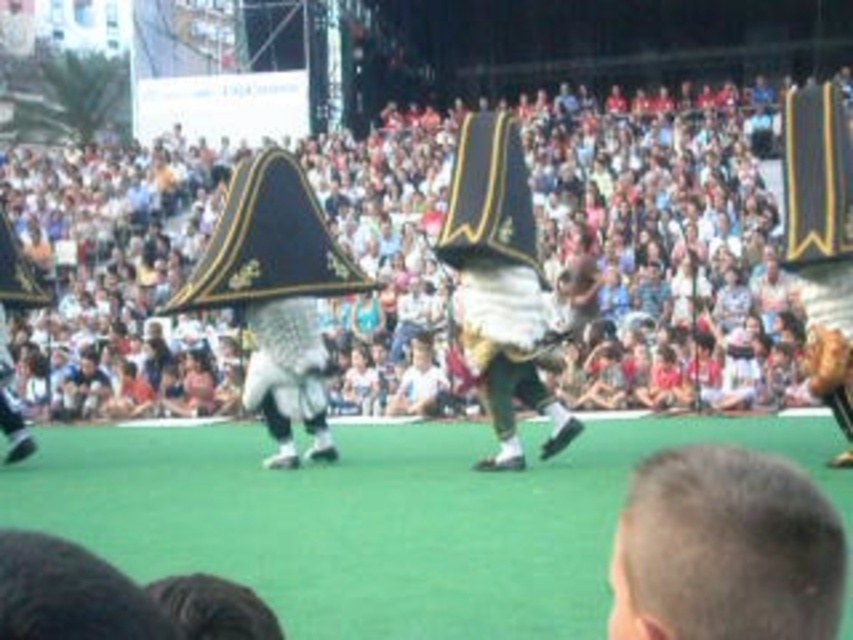
Question: Which point is farther to the camera?

Choices:
 (A) matte white crowd at upper center
 (B) blonde hair at lower right
 (C) white fabric costume at center

Answer: (A)

Question: Which point is farther from the camera taking this photo?

Choices:
 (A) (112, 195)
 (B) (734, 554)
 (C) (483, 168)

Answer: (A)

Question: Is blonde hair at lower right bigger than white fabric costume at center?

Choices:
 (A) yes
 (B) no

Answer: (B)

Question: Can you confirm if matte white crowd at upper center is positioned to the left of white fabric costume at center?

Choices:
 (A) no
 (B) yes

Answer: (B)

Question: Estimate the real-world distances between objects in this image. Which object is farther from the matte white crowd at upper center?

Choices:
 (A) white fabric costume at center
 (B) blonde hair at lower right

Answer: (B)

Question: Can you confirm if matte white crowd at upper center is thinner than blonde hair at lower right?

Choices:
 (A) yes
 (B) no

Answer: (B)